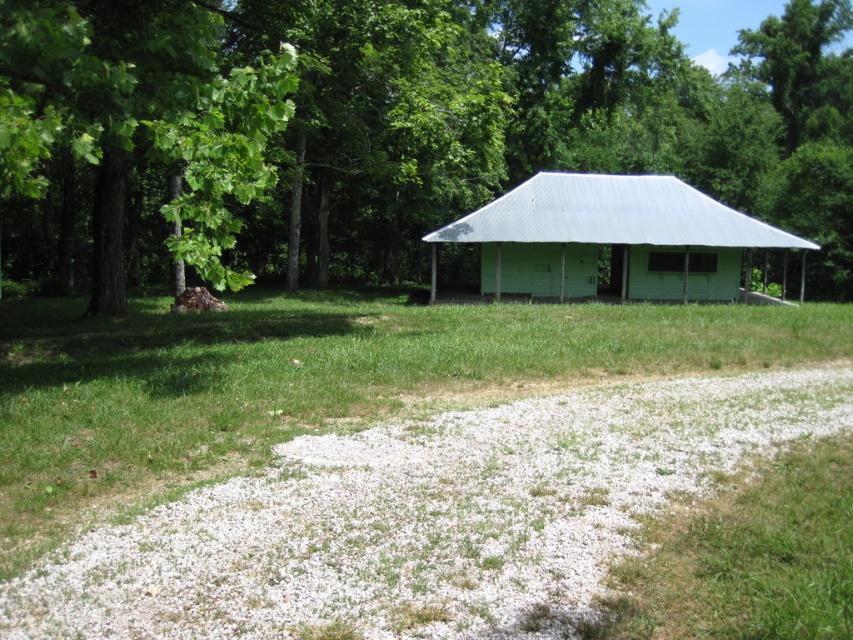
You are standing at the entrance of the building and want to know the position of the green leafy tree at upper left relative to your location. Is the tree to your left or right side?

The green leafy tree at upper left is located at point coordinates that place it to the left side of your position at the entrance.